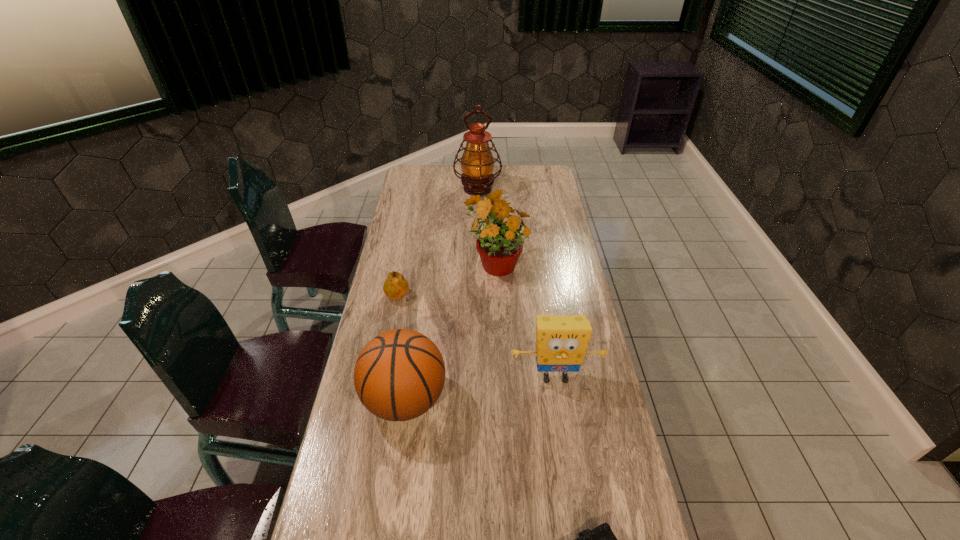
Locate an element on the screen. oil lamp is located at coordinates (477, 163).

Identify the location of the farthest object. The height and width of the screenshot is (540, 960). (477, 163).

At what (x,y) coordinates should I click in order to perform the action: click on flowerpot. Please return your answer as a coordinate pair (x, y). This screenshot has height=540, width=960. Looking at the image, I should click on 498,244.

Image resolution: width=960 pixels, height=540 pixels. Identify the location of the fifth shortest object. 498,244.

At what (x,y) coordinates should I click in order to perform the action: click on basketball. Please return your answer as a coordinate pair (x, y). This screenshot has height=540, width=960. Looking at the image, I should click on (399, 375).

Image resolution: width=960 pixels, height=540 pixels. I want to click on sponge, so click(x=561, y=341).

The height and width of the screenshot is (540, 960). Identify the location of the third farthest object. (396, 286).

Locate an element on the screen. This screenshot has height=540, width=960. pear is located at coordinates (396, 286).

At what (x,y) coordinates should I click in order to perform the action: click on free location located on the front of the oil lamp. Please return your answer as a coordinate pair (x, y). The width and height of the screenshot is (960, 540). Looking at the image, I should click on (477, 232).

Find the location of `vacant space located 0.090m on the back of the fifth nearest object`. vacant space located 0.090m on the back of the fifth nearest object is located at coordinates (494, 231).